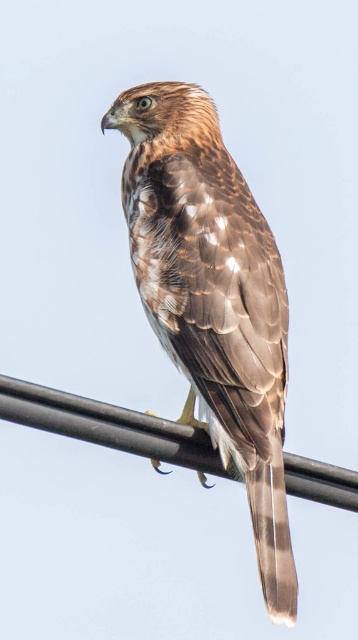
Question: Among these objects, which one is nearest to the camera?

Choices:
 (A) black metal power line at center
 (B) brown feathered eagle at center

Answer: (A)

Question: Where is brown feathered eagle at center located in relation to black metal power line at center in the image?

Choices:
 (A) left
 (B) right

Answer: (B)

Question: Is brown feathered eagle at center smaller than black metal power line at center?

Choices:
 (A) yes
 (B) no

Answer: (B)

Question: Is brown feathered eagle at center below black metal power line at center?

Choices:
 (A) no
 (B) yes

Answer: (A)